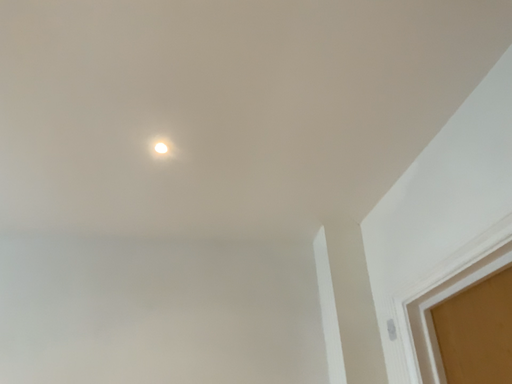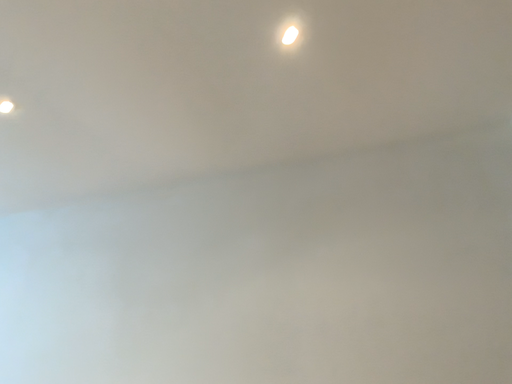
Question: Which way did the camera rotate in the video?

Choices:
 (A) rotated upward
 (B) rotated downward

Answer: (B)